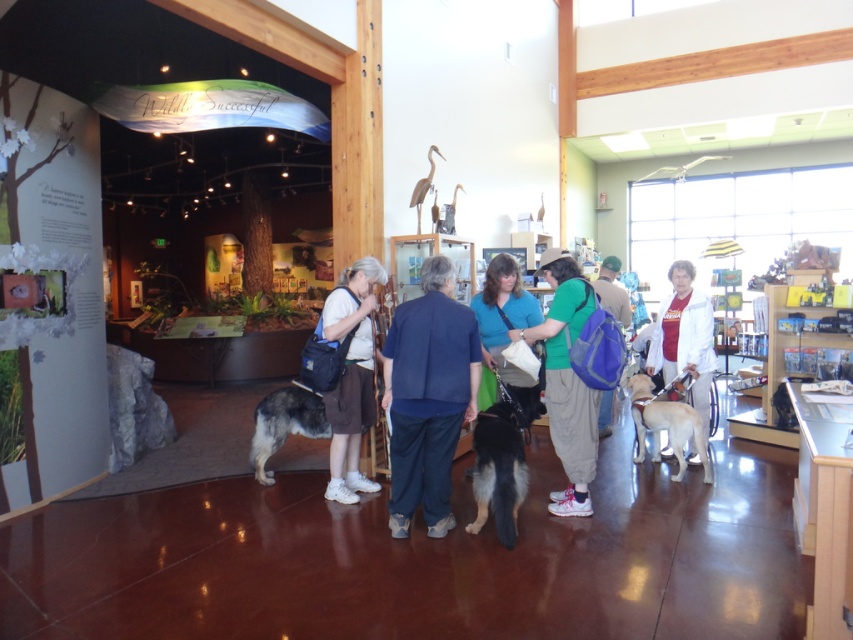
You are a visitor at the museum and want to pick up your belongings. You see the green fabric backpack at center and the white matte jacket at center. Which one is closer to you?

The green fabric backpack at center is closer to you because it is in front of the white matte jacket at center.

You are standing in the museum and see two people wearing jackets. The blue fabric jacket at center and the white matte jacket at center. Which jacket is positioned to the left?

The blue fabric jacket at center is to the left of the white matte jacket at center.